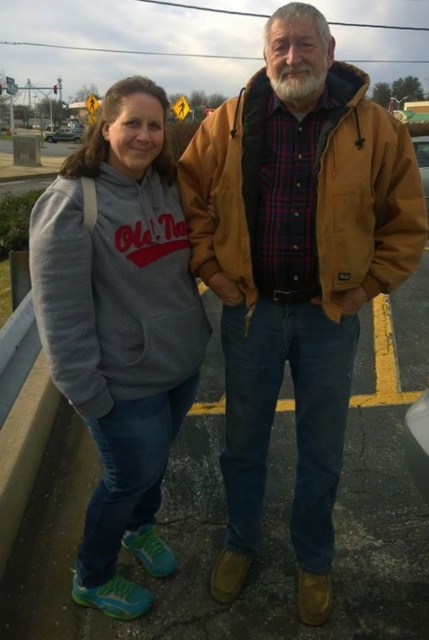
You are trying to locate the point at coordinates (120, 326) in this parking lot scene. Which object from the scene is this point located on?

The point at coordinates (120, 326) is located on the gray fleece hoodie at left.

You are trying to decide whether to hang the brown leather jacket at center on a standard coat hanger that can hold up to 10 pounds. The silver metallic sedan at left weighs 3,000 pounds. Can the coat hanger support the jacket?

The brown leather jacket at center is bigger than the silver metallic sedan at left, so the jacket is heavier than the sedan. Since the sedan weighs 3,000 pounds, the coat hanger cannot support the jacket.